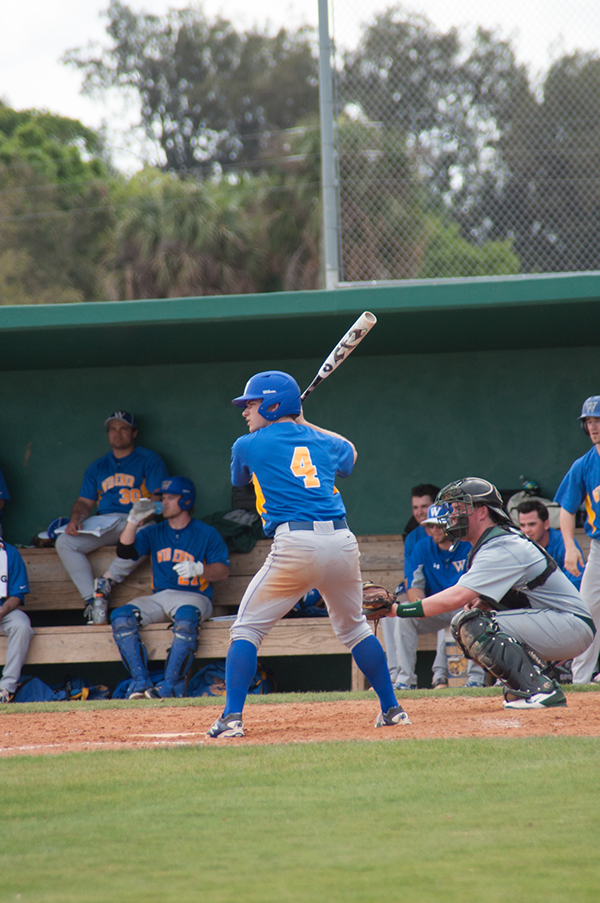
This screenshot has width=600, height=903. What are the coordinates of `bench` in the screenshot? It's located at (x=311, y=641).